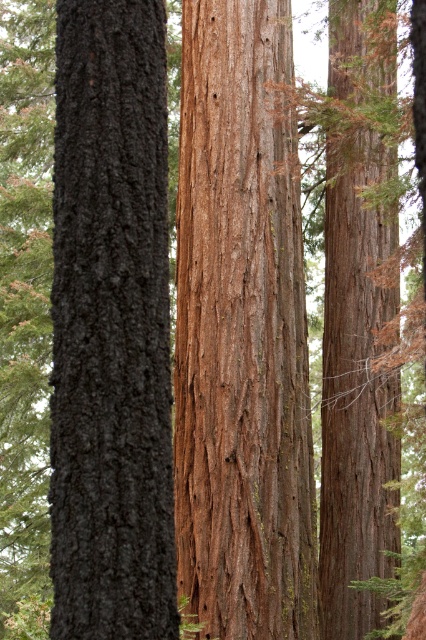
You are a hiker trying to navigate through the forest. You see two trees ahead of you, the brown rough bark tree at center and the brown rough bark tree at right. Which tree should you approach if you want to find the wider path between them?

The brown rough bark tree at center is larger in size than the brown rough bark tree at right, so the wider path is likely near the brown rough bark tree at right since it is smaller and may have more space around it.

Based on the photo, you are a hiker trying to identify the tallest tree between the dark gray bark tree at left and the brown rough bark tree at right. Based on the scene, which tree is taller?

The brown rough bark tree at right is taller than the dark gray bark tree at left according to the description.